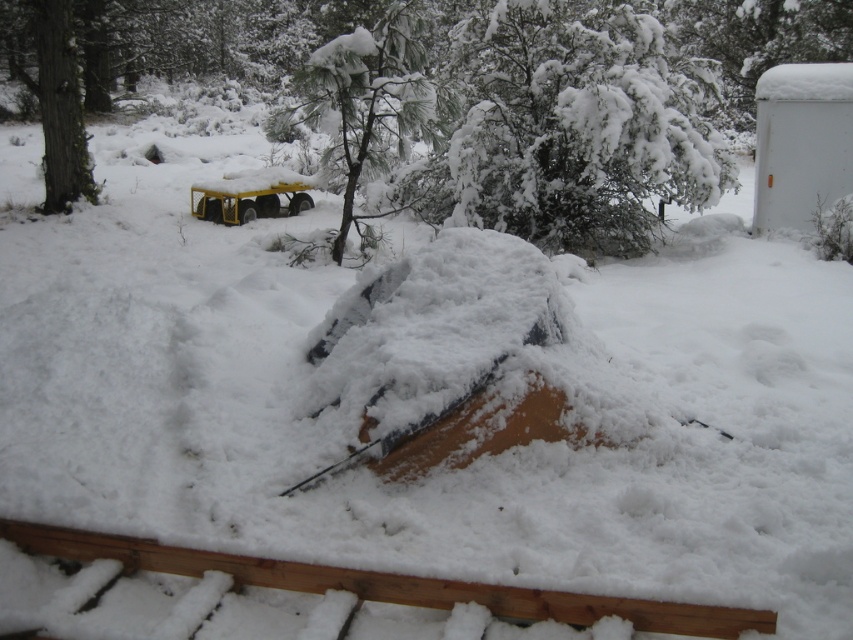
Can you confirm if white fluffy tree at upper center is smaller than smooth bark tree at upper left?

Yes.

Is point (494, 104) behind point (26, 13)?

No, (494, 104) is in front of (26, 13).

Locate an element on the screen. white fluffy tree at upper center is located at coordinates (579, 124).

Does snow-covered pine tree at center come in front of smooth bark tree at upper left?

Yes, snow-covered pine tree at center is in front of smooth bark tree at upper left.

Which of these two, snow-covered pine tree at center or smooth bark tree at upper left, stands taller?

smooth bark tree at upper left

Which is behind, point (335, 61) or point (57, 186)?

The point (57, 186) is more distant.

Identify the location of snow-covered pine tree at center. The image size is (853, 640). (367, 102).

From the picture: Who is shorter, white fluffy tree at upper center or snow-covered pine tree at center?

Standing shorter between the two is snow-covered pine tree at center.

Is white fluffy tree at upper center bigger than snow-covered pine tree at center?

Yes, white fluffy tree at upper center is bigger than snow-covered pine tree at center.

Who is more forward, [512,42] or [413,35]?

Point [413,35] is more forward.

What are the coordinates of `white fluffy tree at upper center` in the screenshot? It's located at (579, 124).